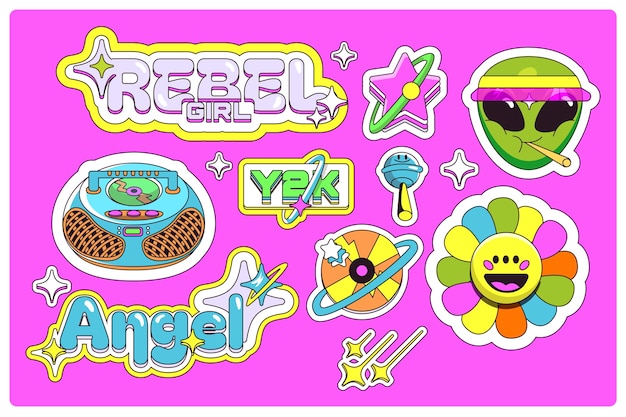
Locate an element on the screen. This screenshot has width=626, height=417. stereo is located at coordinates (128, 258).